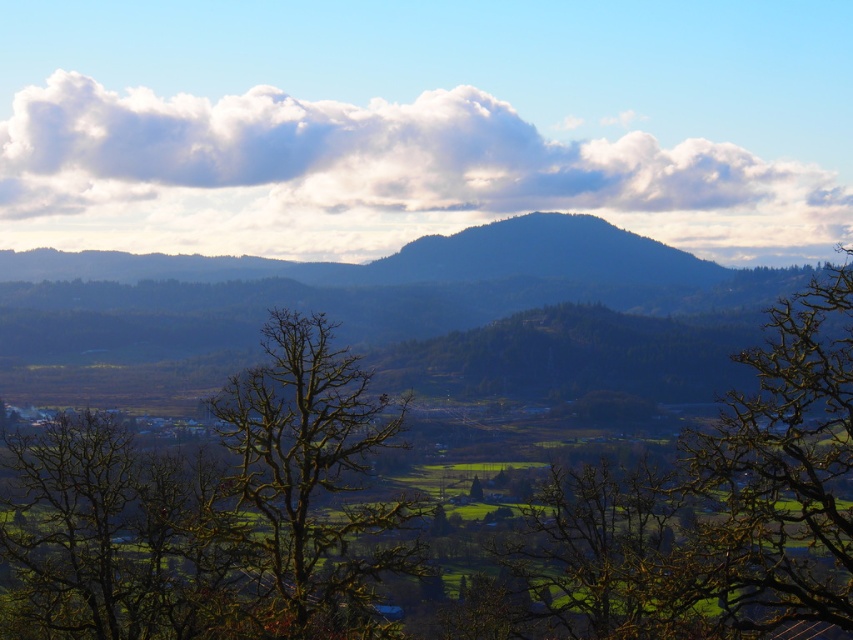
Who is more forward, [184,182] or [337,621]?

Point [337,621]

Can you confirm if cloudy sky at upper center is bigger than bare branches at center?

Correct, cloudy sky at upper center is larger in size than bare branches at center.

What are the coordinates of `cloudy sky at upper center` in the screenshot? It's located at (372, 177).

Is bare branches at center thinner than green matte tree at center?

No.

Does bare branches at center have a smaller size compared to green matte tree at center?

No, bare branches at center is not smaller than green matte tree at center.

What do you see at coordinates (308, 483) in the screenshot?
I see `bare branches at center` at bounding box center [308, 483].

At what (x,y) coordinates should I click in order to perform the action: click on bare branches at center. Please return your answer as a coordinate pair (x, y). Looking at the image, I should click on (308, 483).

Between point (641, 138) and point (479, 483), which one is positioned in front?

Positioned in front is point (479, 483).

Is point (793, 216) in front of point (471, 492)?

No, it is not.

What do you see at coordinates (372, 177) in the screenshot? Image resolution: width=853 pixels, height=640 pixels. I see `cloudy sky at upper center` at bounding box center [372, 177].

You are a GUI agent. You are given a task and a screenshot of the screen. Output one action in this format:
    pyautogui.click(x=<x>, y=<y>)
    Task: Click on the cloudy sky at upper center
    
    Given the screenshot: What is the action you would take?
    372,177